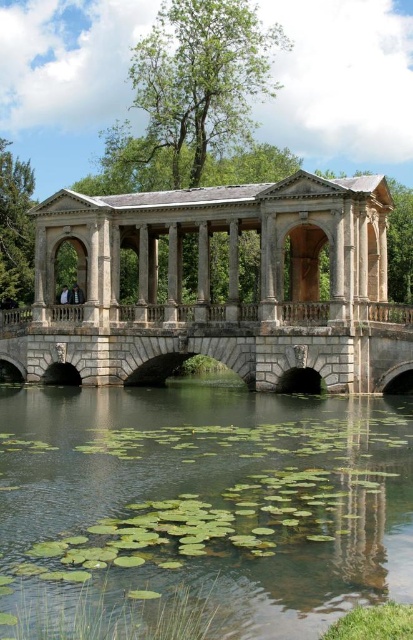
You are standing on the shore of the lake and want to take a photo of both the green leafy water at center and the stone arch bridge at center. Which object will appear larger in your photo?

The green leafy water at center will appear larger in the photo because it is closer to the viewer than the stone arch bridge at center.

You are standing at the edge of the water and want to reach the stone gazebo at center. Based on the coordinates provided, in which direction should you head to reach it?

The stone gazebo at center is located at coordinates 0.452 on the x axis and 0.552 on the y axis. Since you are at the edge of the water, you should head towards the center of the image where the gazebo is positioned.

You are standing on the classical stone bridge and want to drop a small pebble into the water. If you aim directly below your feet, will the pebble land in the green leafy water at center?

The green leafy water at center is located at coordinates point (199, 509), so if you drop the pebble directly below your feet on the bridge, it will land in the green leafy water at center.